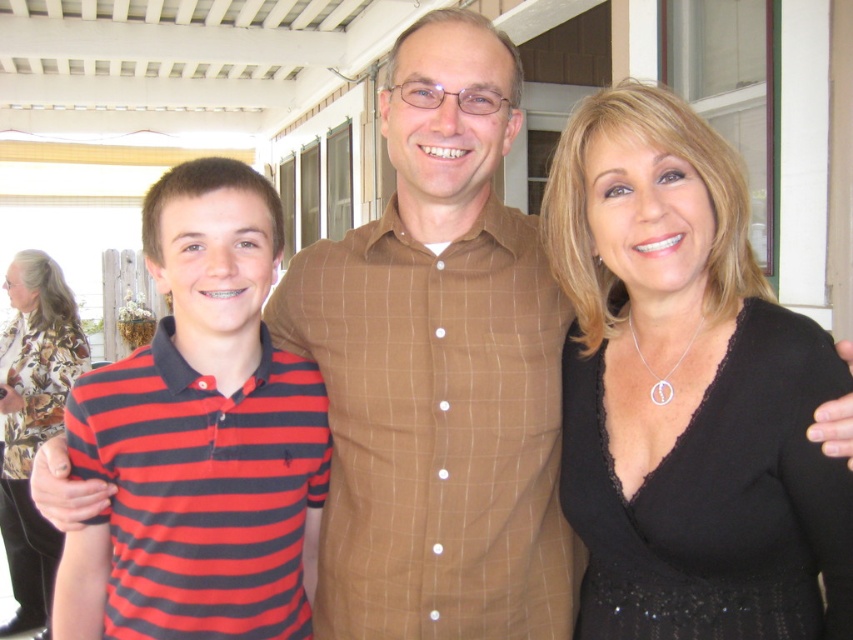
Is brown checkered shirt at center closer to camera compared to printed silk blouse at left?

Yes, brown checkered shirt at center is closer to the viewer.

From the picture: Who is more forward, [466,282] or [20,356]?

Point [466,282] is more forward.

Does point (466, 636) come behind point (10, 545)?

No, (466, 636) is closer to viewer.

Image resolution: width=853 pixels, height=640 pixels. I want to click on brown checkered shirt at center, so click(436, 429).

Can you confirm if brown checkered shirt at center is positioned above striped cotton polo shirt at left?

No.

Which is below, brown checkered shirt at center or striped cotton polo shirt at left?

brown checkered shirt at center

Is point (381, 468) positioned behind point (254, 212)?

Yes, point (381, 468) is farther from viewer.

Locate an element on the screen. This screenshot has width=853, height=640. brown checkered shirt at center is located at coordinates (436, 429).

Does black lace dress at center appear under printed silk blouse at left?

No.

Can you confirm if black lace dress at center is thinner than printed silk blouse at left?

Yes.

At what (x,y) coordinates should I click in order to perform the action: click on black lace dress at center. Please return your answer as a coordinate pair (x, y). This screenshot has width=853, height=640. Looking at the image, I should click on (688, 392).